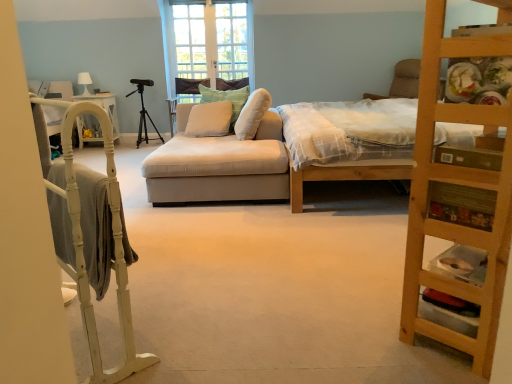
Describe the element at coordinates (252, 114) in the screenshot. I see `green textured pillow at center, placed as the third pillow when sorted from left to right` at that location.

This screenshot has height=384, width=512. What do you see at coordinates (459, 196) in the screenshot?
I see `wooden ladder at right` at bounding box center [459, 196].

This screenshot has height=384, width=512. Find the location of `white painted wood bunk bed at left`. white painted wood bunk bed at left is located at coordinates (83, 237).

Describe the element at coordinates (83, 237) in the screenshot. I see `white painted wood bunk bed at left` at that location.

In order to click on wooden bed at center in this screenshot , I will do `click(345, 175)`.

Image resolution: width=512 pixels, height=384 pixels. I want to click on black matte tripod at center, so click(143, 112).

Locate an element on the screen. This screenshot has width=512, height=384. white fabric cat bed at left is located at coordinates (104, 108).

What is the approximate height of white glass door at center?

It is 1.37 meters.

The width and height of the screenshot is (512, 384). What are the coordinates of `green textured pillow at center, placed as the first pillow when sorted from right to left` in the screenshot? It's located at (252, 114).

Does point (246, 89) lie in front of point (318, 179)?

No, it is behind (318, 179).

Considering the relative positions of soft green pillow at center, which appears as the 2th pillow when viewed from the right, and wooden bed at center in the image provided, is soft green pillow at center, which appears as the 2th pillow when viewed from the right, in front of wooden bed at center?

No, the depth of soft green pillow at center, which appears as the 2th pillow when viewed from the right, is greater than that of wooden bed at center.

Who is smaller, soft green pillow at center, positioned as the second pillow in left-to-right order, or wooden bed at center?

Smaller between the two is soft green pillow at center, positioned as the second pillow in left-to-right order.

In the scene shown: Which of these two, soft green pillow at center, positioned as the second pillow in left-to-right order, or green textured pillow at center, placed as the first pillow when sorted from right to left, stands shorter?

green textured pillow at center, placed as the first pillow when sorted from right to left, is shorter.

Considering the relative positions of soft green pillow at center, which appears as the 2th pillow when viewed from the right, and green textured pillow at center, placed as the third pillow when sorted from left to right, in the image provided, is soft green pillow at center, which appears as the 2th pillow when viewed from the right, behind green textured pillow at center, placed as the third pillow when sorted from left to right,?

That is True.

The height and width of the screenshot is (384, 512). Find the location of `the 1st pillow counting from the left side of the green textured pillow at center, placed as the third pillow when sorted from left to right`. the 1st pillow counting from the left side of the green textured pillow at center, placed as the third pillow when sorted from left to right is located at coordinates (226, 100).

Consider the image. Considering the relative sizes of soft green pillow at center, positioned as the second pillow in left-to-right order, and green textured pillow at center, placed as the first pillow when sorted from right to left, in the image provided, is soft green pillow at center, positioned as the second pillow in left-to-right order, bigger than green textured pillow at center, placed as the first pillow when sorted from right to left,?

No, soft green pillow at center, positioned as the second pillow in left-to-right order, is not bigger than green textured pillow at center, placed as the first pillow when sorted from right to left.

Who is bigger, white soft cushion at center, arranged as the third pillow when viewed from the right, or soft green pillow at center, positioned as the second pillow in left-to-right order?

Bigger between the two is soft green pillow at center, positioned as the second pillow in left-to-right order.

Considering the points (194, 107) and (219, 93), which point is behind, point (194, 107) or point (219, 93)?

The point (219, 93) is behind.

Considering the sizes of objects white soft cushion at center, arranged as the third pillow when viewed from the right, and soft green pillow at center, positioned as the second pillow in left-to-right order, in the image provided, who is shorter, white soft cushion at center, arranged as the third pillow when viewed from the right, or soft green pillow at center, positioned as the second pillow in left-to-right order,?

white soft cushion at center, arranged as the third pillow when viewed from the right.

Could you measure the distance between white soft cushion at center, arranged as the third pillow when viewed from the right, and soft green pillow at center, which appears as the 2th pillow when viewed from the right?

white soft cushion at center, arranged as the third pillow when viewed from the right, is 6.48 inches away from soft green pillow at center, which appears as the 2th pillow when viewed from the right.

Between white glass door at center and green textured pillow at center, placed as the first pillow when sorted from right to left, which one appears on the right side from the viewer's perspective?

green textured pillow at center, placed as the first pillow when sorted from right to left, is more to the right.

From a real-world perspective, is white glass door at center under green textured pillow at center, placed as the first pillow when sorted from right to left?

No, from a real-world perspective, white glass door at center is not under green textured pillow at center, placed as the first pillow when sorted from right to left.

From the image's perspective, which one is positioned higher, white glass door at center or green textured pillow at center, placed as the third pillow when sorted from left to right?

white glass door at center.

How different are the orientations of white glass door at center and green textured pillow at center, placed as the third pillow when sorted from left to right, in degrees?

The facing directions of white glass door at center and green textured pillow at center, placed as the third pillow when sorted from left to right, are 90 degrees apart.

Between wooden ladder at right and white painted wood bunk bed at left, which one has larger size?

Bigger between the two is wooden ladder at right.

Is wooden ladder at right thinner than white painted wood bunk bed at left?

No.

Would you say wooden ladder at right is a long distance from white painted wood bunk bed at left?

Indeed, wooden ladder at right is not near white painted wood bunk bed at left.

Is wooden ladder at right situated inside white painted wood bunk bed at left or outside?

wooden ladder at right is spatially situated outside white painted wood bunk bed at left.

Is point (205, 89) closer to camera compared to point (115, 134)?

No, it is behind (115, 134).

Considering the relative sizes of soft green pillow at center, which appears as the 2th pillow when viewed from the right, and white fabric cat bed at left in the image provided, is soft green pillow at center, which appears as the 2th pillow when viewed from the right, taller than white fabric cat bed at left?

Incorrect, the height of soft green pillow at center, which appears as the 2th pillow when viewed from the right, is not larger of that of white fabric cat bed at left.

Which is more to the left, soft green pillow at center, which appears as the 2th pillow when viewed from the right, or white fabric cat bed at left?

white fabric cat bed at left is more to the left.

Find the location of a particular element. The width and height of the screenshot is (512, 384). the 2nd pillow to the right when counting from the white fabric cat bed at left is located at coordinates [x=226, y=100].

From the image's perspective, is wooden bed at center under black matte tripod at center?

Yes.

Which is closer, (x=487, y=133) or (x=143, y=122)?

Point (x=487, y=133) appears to be closer to the viewer than point (x=143, y=122).

Considering the relative positions of wooden bed at center and black matte tripod at center in the image provided, is wooden bed at center to the right of black matte tripod at center from the viewer's perspective?

Indeed, wooden bed at center is positioned on the right side of black matte tripod at center.

Locate an element on the screen. The image size is (512, 384). bed on the right side of soft green pillow at center, positioned as the second pillow in left-to-right order is located at coordinates (345, 175).

In order to click on the 2nd pillow in front when counting from the soft green pillow at center, positioned as the second pillow in left-to-right order in this screenshot , I will do `click(252, 114)`.

Looking at the image, which one is located closer to wooden bed at center, black matte tripod at center or beige fabric couch at center?

The object closer to wooden bed at center is beige fabric couch at center.

Considering their positions, is black matte tripod at center positioned closer to soft green pillow at center, positioned as the second pillow in left-to-right order, than wooden ladder at right?

Based on the image, black matte tripod at center appears to be nearer to soft green pillow at center, positioned as the second pillow in left-to-right order.

In the scene shown: When comparing their distances from white painted wood bunk bed at left, does wooden bed at center or white glass door at center seem further?

white glass door at center lies further to white painted wood bunk bed at left than the other object.

From the picture: From the image, which object appears to be nearer to wooden bed at center, white glass door at center or wooden ladder at right?

wooden ladder at right is closer to wooden bed at center.

When comparing their distances from white soft cushion at center, arranged as the third pillow when viewed from the right, does soft green pillow at center, which appears as the 2th pillow when viewed from the right, or wooden ladder at right seem further?

wooden ladder at right is positioned further to the anchor white soft cushion at center, arranged as the third pillow when viewed from the right.

Looking at the image, which one is located closer to white fabric cat bed at left, black matte tripod at center or wooden bed at center?

Based on the image, black matte tripod at center appears to be nearer to white fabric cat bed at left.

When comparing their distances from soft green pillow at center, which appears as the 2th pillow when viewed from the right, does green textured pillow at center, placed as the third pillow when sorted from left to right, or white glass door at center seem closer?

Based on the image, green textured pillow at center, placed as the third pillow when sorted from left to right, appears to be nearer to soft green pillow at center, which appears as the 2th pillow when viewed from the right.

When comparing their distances from soft green pillow at center, positioned as the second pillow in left-to-right order, does white painted wood bunk bed at left or white fabric cat bed at left seem closer?

Among the two, white fabric cat bed at left is located nearer to soft green pillow at center, positioned as the second pillow in left-to-right order.

Where is `pillow positioned between beige fabric couch at center and white soft cushion at center, arranged as the third pillow when viewed from the right, from near to far`? Image resolution: width=512 pixels, height=384 pixels. pillow positioned between beige fabric couch at center and white soft cushion at center, arranged as the third pillow when viewed from the right, from near to far is located at coordinates (252, 114).

Identify the location of bed between wooden ladder at right and green textured pillow at center, placed as the third pillow when sorted from left to right, from front to back. The height and width of the screenshot is (384, 512). (345, 175).

Image resolution: width=512 pixels, height=384 pixels. I want to click on tripod positioned between wooden ladder at right and white fabric cat bed at left from near to far, so click(x=143, y=112).

Find the location of `bed between white painted wood bunk bed at left and black matte tripod at center in the front-back direction`. bed between white painted wood bunk bed at left and black matte tripod at center in the front-back direction is located at coordinates (345, 175).